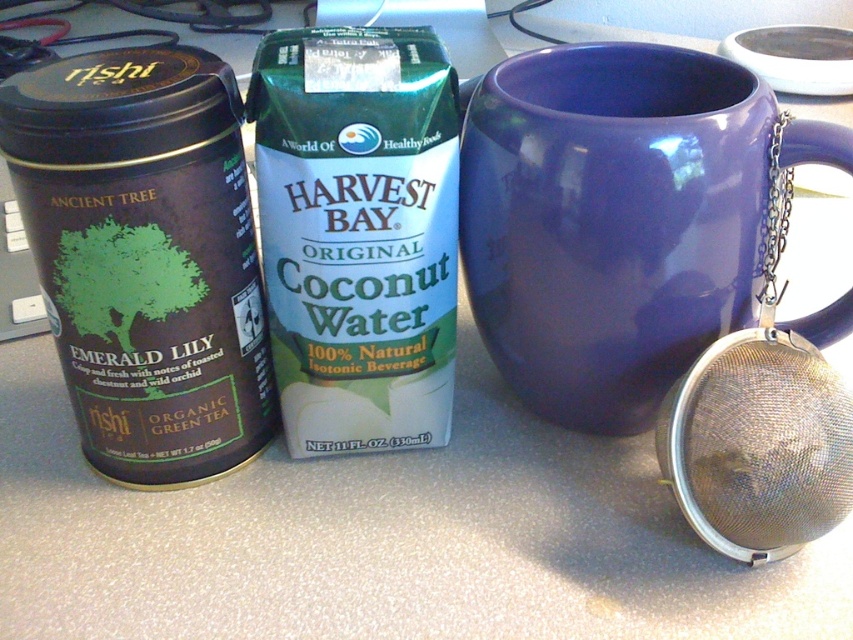
Question: Is glossy ceramic mug at upper center further to the viewer compared to silver mesh strainer at right?

Choices:
 (A) yes
 (B) no

Answer: (A)

Question: Which object is closer to the camera taking this photo?

Choices:
 (A) matte black organic green tea can at left
 (B) silver mesh strainer at right
 (C) glossy ceramic mug at upper center

Answer: (A)

Question: Is matte black organic green tea can at left to the left of silver mesh strainer at right from the viewer's perspective?

Choices:
 (A) no
 (B) yes

Answer: (B)

Question: Which is farther from the glossy ceramic mug at upper center?

Choices:
 (A) silver mesh strainer at right
 (B) matte black organic green tea can at left

Answer: (B)

Question: Which is farther from the matte black organic green tea can at left?

Choices:
 (A) silver mesh strainer at right
 (B) glossy ceramic mug at upper center

Answer: (A)

Question: Does glossy ceramic mug at upper center have a larger size compared to silver mesh strainer at right?

Choices:
 (A) yes
 (B) no

Answer: (A)